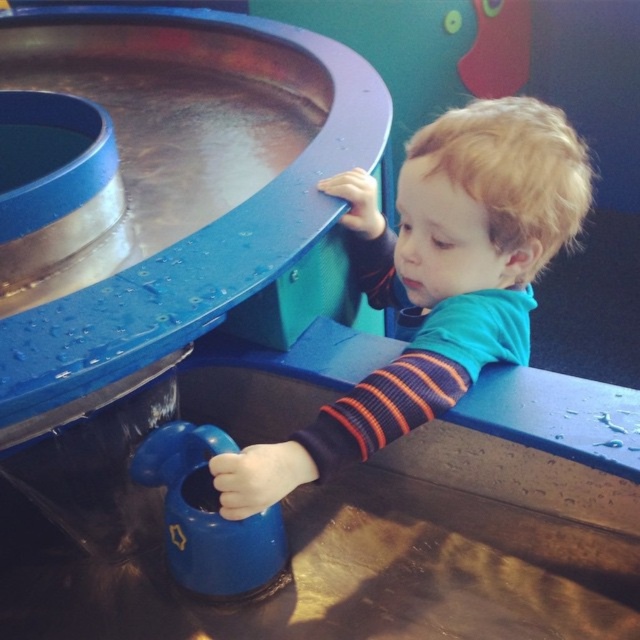
Question: Does blue matte shirt at upper right have a smaller size compared to blue rubber toy at lower center?

Choices:
 (A) yes
 (B) no

Answer: (B)

Question: In this image, where is blue matte shirt at upper right located relative to blue rubber toy at lower center?

Choices:
 (A) left
 (B) right

Answer: (B)

Question: Can you confirm if blue matte shirt at upper right is positioned below blue rubber toy at lower center?

Choices:
 (A) yes
 (B) no

Answer: (B)

Question: Which point is closer to the camera taking this photo?

Choices:
 (A) (225, 525)
 (B) (417, 348)

Answer: (B)

Question: Which object appears closest to the camera in this image?

Choices:
 (A) blue matte shirt at upper right
 (B) blue rubber toy at lower center

Answer: (A)